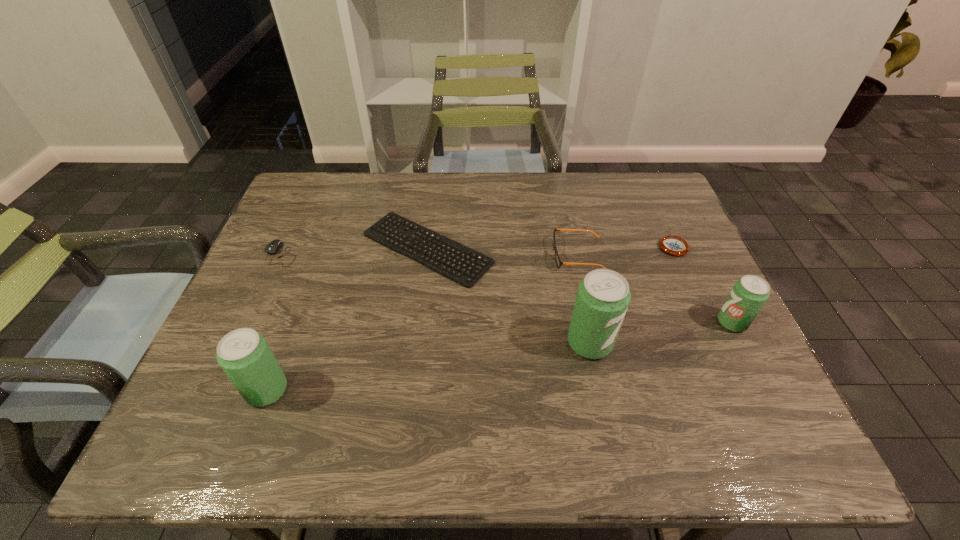
To make them evenly spaced by inserting another pop_(soda) among them, please locate a vacant spot for this new pop_(soda). Please provide its 2D coordinates. Your answer should be formatted as a tuple, i.e. [(x, y)], where the tuple contains the x and y coordinates of a point satisfying the conditions above.

[(435, 366)]